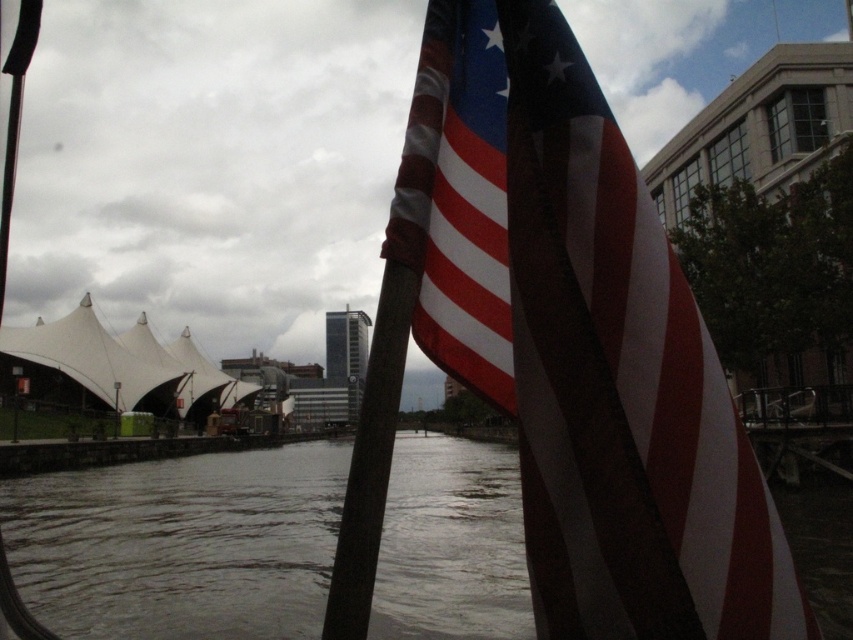
You are standing in the waterfront area and want to take a photo of the american flag at upper right and the dark brown wooden pole at center. Which object should you focus on first to ensure both are in the frame?

You should focus on the american flag at upper right first because it is closer to you than the dark brown wooden pole at center, ensuring both are in the frame.

You are standing at the waterfront and want to walk from the dark brown wooden pole at center to the dark gray water at center. Which direction should you move in to reach the water first?

You should move towards the direction of the dark gray water at center because it is closer to you than the dark brown wooden pole at center.

You are standing at the waterfront and see the american flag at upper right and the dark gray water at center. Which object is nearer to you?

The american flag at upper right is closer to the viewer than the dark gray water at center.